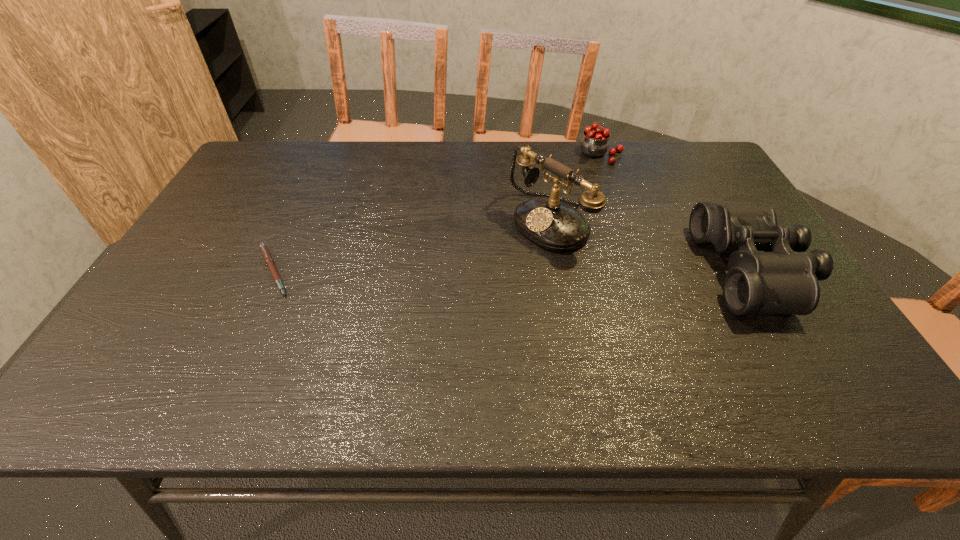
Where is `free location that satisfies the following two spatial constraints: 1. on the front side of the tallest object; 2. at the eyepieces of the binoculars`? free location that satisfies the following two spatial constraints: 1. on the front side of the tallest object; 2. at the eyepieces of the binoculars is located at coordinates (557, 270).

Find the location of a particular element. The width and height of the screenshot is (960, 540). vacant space that satisfies the following two spatial constraints: 1. on the front side of the rightmost object; 2. at the eyepieces of the telephone is located at coordinates (557, 270).